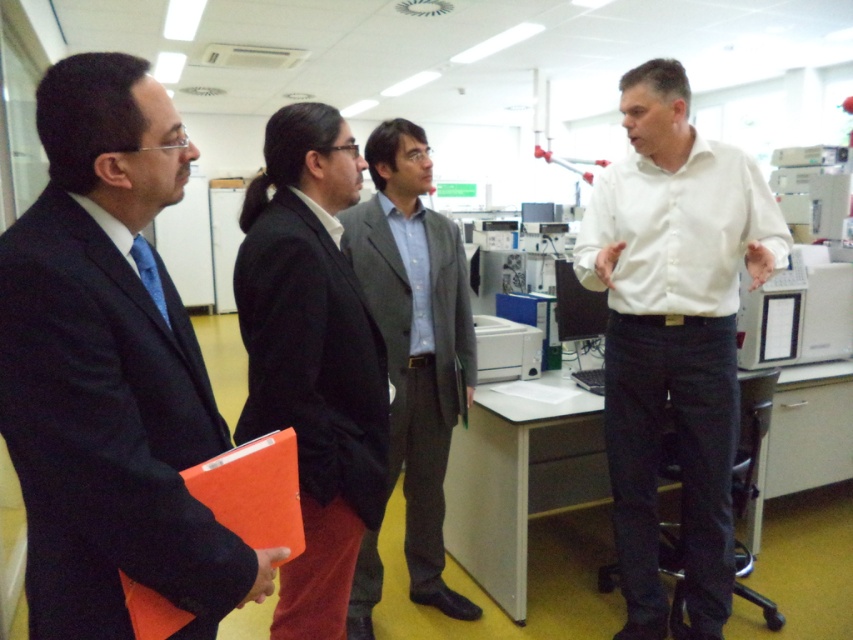
Question: Which point is closer to the camera?

Choices:
 (A) (106, 241)
 (B) (289, 116)
 (C) (636, 227)
 (D) (355, 218)

Answer: (A)

Question: Does black suit at left appear over orange matte folder at lower left?

Choices:
 (A) yes
 (B) no

Answer: (A)

Question: Which point appears farthest from the camera in this image?

Choices:
 (A) (631, 208)
 (B) (410, 454)

Answer: (B)

Question: Is black suit at left below white shirt at center?

Choices:
 (A) yes
 (B) no

Answer: (B)

Question: Observing the image, what is the correct spatial positioning of black suit at center in reference to gray wool suit at center?

Choices:
 (A) below
 (B) above

Answer: (B)

Question: Considering the real-world distances, which object is closest to the black suit at left?

Choices:
 (A) orange matte folder at lower left
 (B) black suit at center
 (C) white shirt at center
 (D) gray wool suit at center

Answer: (A)